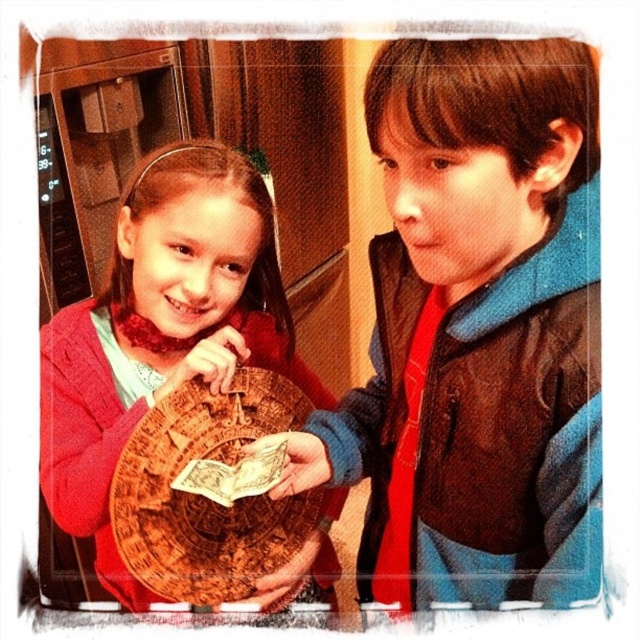
Does blue fleece jacket at upper right appear under matte brown wooden puzzle at center?

Incorrect, blue fleece jacket at upper right is not positioned below matte brown wooden puzzle at center.

Does blue fleece jacket at upper right have a lesser width compared to matte brown wooden puzzle at center?

Yes, blue fleece jacket at upper right is thinner than matte brown wooden puzzle at center.

Measure the distance between point (564,328) and camera.

They are 23.45 inches apart.

Identify the location of blue fleece jacket at upper right. (476, 332).

Is matte brown wooden puzzle at center closer to the viewer compared to wooden puzzle piece at center?

That is True.

Find the location of `matte brown wooden puzzle at center`. matte brown wooden puzzle at center is located at coordinates (161, 330).

Find the location of a particular element. Image resolution: width=640 pixels, height=640 pixels. matte brown wooden puzzle at center is located at coordinates (161, 330).

In the scene shown: Can you confirm if blue fleece jacket at upper right is shorter than wooden puzzle piece at center?

No, blue fleece jacket at upper right is not shorter than wooden puzzle piece at center.

Is the position of blue fleece jacket at upper right less distant than that of wooden puzzle piece at center?

Yes, it is.

Locate an element on the screen. Image resolution: width=640 pixels, height=640 pixels. blue fleece jacket at upper right is located at coordinates (476, 332).